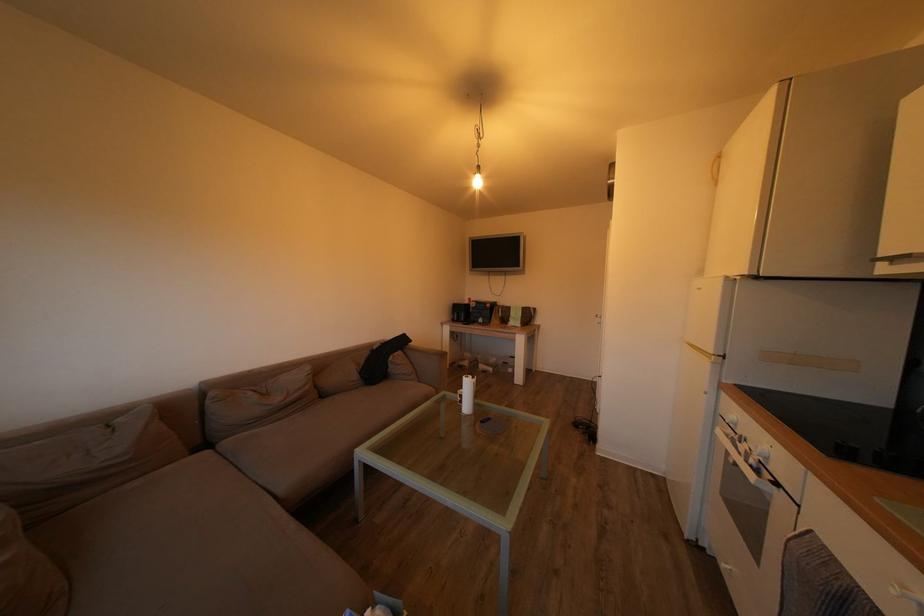
The location [381,359] corresponds to which object?

It corresponds to the black bag in the image.